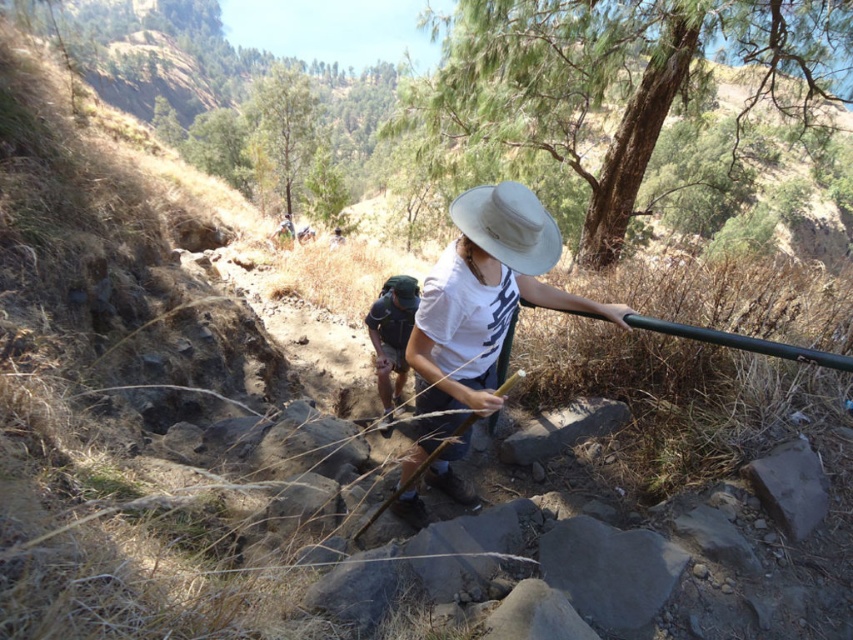
Question: Which is farther from the camouflage backpack at center?

Choices:
 (A) white matte hat at center
 (B) beige fabric hat at center

Answer: (B)

Question: Does beige fabric hat at center come in front of camouflage backpack at center?

Choices:
 (A) no
 (B) yes

Answer: (B)

Question: Does beige fabric hat at center appear over camouflage backpack at center?

Choices:
 (A) no
 (B) yes

Answer: (B)

Question: Which of these objects is positioned closest to the beige fabric hat at center?

Choices:
 (A) camouflage backpack at center
 (B) white matte hat at center

Answer: (B)

Question: Which object appears farthest from the camera in this image?

Choices:
 (A) white matte hat at center
 (B) camouflage backpack at center

Answer: (B)

Question: Can you confirm if white matte hat at center is wider than camouflage backpack at center?

Choices:
 (A) yes
 (B) no

Answer: (A)